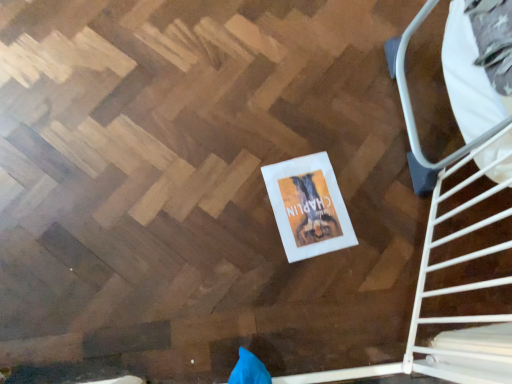
The width and height of the screenshot is (512, 384). Find the location of `free point below white metal gate at upper right (from a real-world perspective)`. free point below white metal gate at upper right (from a real-world perspective) is located at coordinates (417, 270).